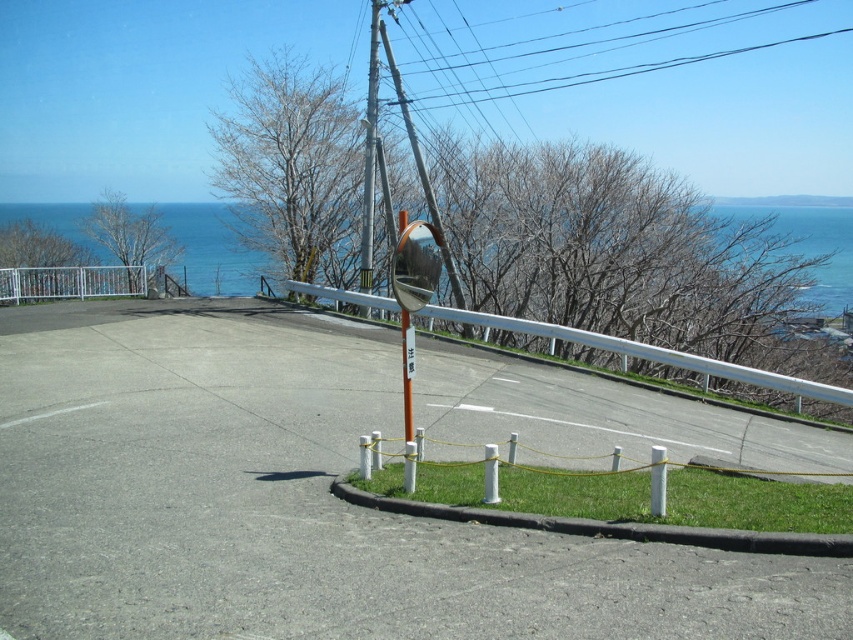
You are a delivery driver approaching the coastal road curve. You need to secure a package on the roof of your vehicle using a black wire. The black wire is located at point (589, 74). Where exactly should you look to find the black wire?

The black wire is located at the upper center of the image, corresponding to point (589, 74).

You are driving a car that is 15 feet long and need to park it near the road. There is a white metallic fence at upper left and a metallic gray pole at center. Can you park your car between these two objects without overlapping either of them?

The distance between the white metallic fence at upper left and the metallic gray pole at center is 30.06 feet. Since your car is 15 feet long, there is enough space to park between them without overlapping either object.

You are driving a delivery truck that is 5 meters long. You need to make a U turn at this location. There is a white metal guardrail at center and a metallic gray pole at center in the way. Can you safely complete the U turn without hitting either object?

The distance between the white metal guardrail at center and the metallic gray pole at center is 4.92 meters. Since your truck is 5 meters long, which is slightly longer than the available space, you cannot safely complete the U turn without risking collision with either object.